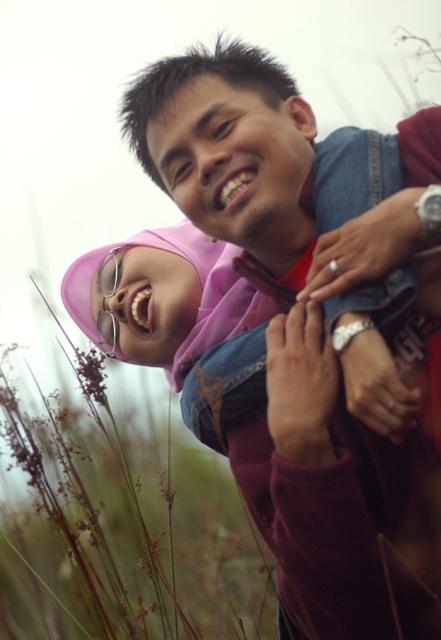
Question: Observing the image, what is the correct spatial positioning of denim jacket at upper center in reference to pink satin hijab at upper center?

Choices:
 (A) above
 (B) below

Answer: (B)

Question: Which object is farther from the camera taking this photo?

Choices:
 (A) denim jacket at upper center
 (B) pink satin hijab at upper center

Answer: (B)

Question: Is denim jacket at upper center positioned at the back of pink satin hijab at upper center?

Choices:
 (A) no
 (B) yes

Answer: (A)

Question: Which of the following is the farthest from the observer?

Choices:
 (A) (362, 516)
 (B) (206, 332)

Answer: (B)

Question: Can you confirm if denim jacket at upper center is thinner than pink satin hijab at upper center?

Choices:
 (A) no
 (B) yes

Answer: (A)

Question: Which of the following is the closest to the observer?

Choices:
 (A) (385, 259)
 (B) (217, 280)

Answer: (A)